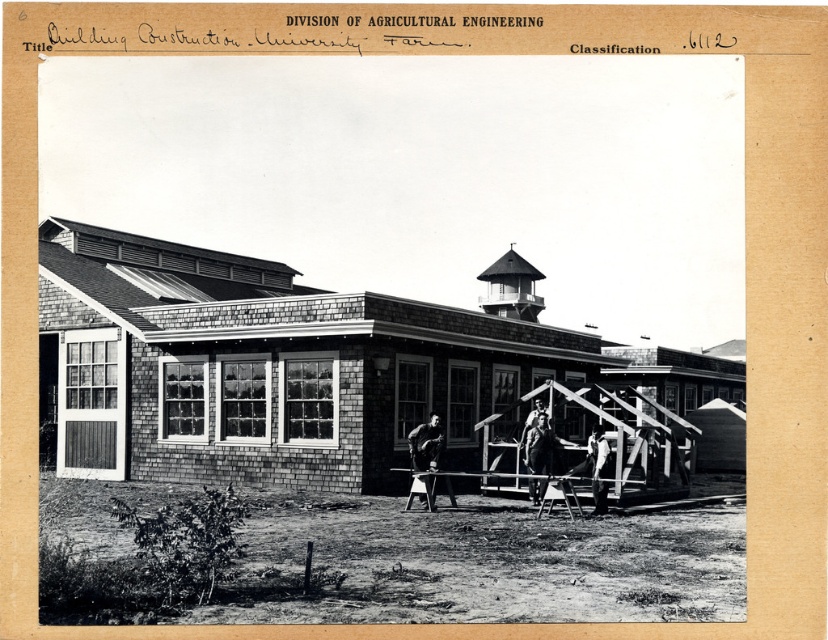
Question: Observing the image, what is the correct spatial positioning of smooth wooden frame at center in reference to wooden ladder at center?

Choices:
 (A) below
 (B) above

Answer: (B)

Question: Which point appears closest to the camera in this image?

Choices:
 (A) (535, 477)
 (B) (412, 433)
 (C) (567, 497)

Answer: (C)

Question: Which point is closer to the camera?

Choices:
 (A) wooden ladder at center
 (B) metallic silver ladder at center
 (C) smooth leather jacket at center

Answer: (B)

Question: Which point is farther to the camera?

Choices:
 (A) smooth wooden frame at center
 (B) smooth leather jacket at center
 (C) metallic silver ladder at center
 (D) wooden ladder at center

Answer: (A)

Question: Does smooth wooden frame at center have a greater width compared to smooth leather jacket at center?

Choices:
 (A) no
 (B) yes

Answer: (B)

Question: Does smooth wooden frame at center have a smaller size compared to metallic silver ladder at center?

Choices:
 (A) no
 (B) yes

Answer: (A)